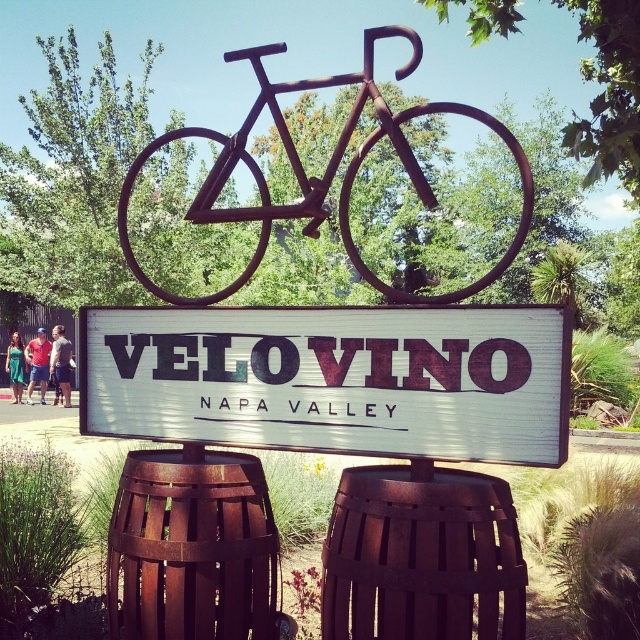
Question: Which point appears farthest from the camera in this image?

Choices:
 (A) (186, 566)
 (B) (426, 416)

Answer: (A)

Question: Is rusty metal barrel at center closer to the viewer compared to rusty wood barrel at center?

Choices:
 (A) yes
 (B) no

Answer: (A)

Question: Which object is farther from the camera taking this photo?

Choices:
 (A) white matte sign at center
 (B) rusty metal bicycle at center
 (C) rusty wood barrel at center

Answer: (C)

Question: Which object is the closest to the rusty metal bicycle at center?

Choices:
 (A) rusty wood barrel at center
 (B) white matte sign at center
 (C) rusty metal barrel at center

Answer: (A)

Question: Does rusty metal barrel at center have a larger size compared to rusty wood barrel at center?

Choices:
 (A) yes
 (B) no

Answer: (B)

Question: Does rusty metal barrel at center have a larger size compared to rusty metal bicycle at center?

Choices:
 (A) yes
 (B) no

Answer: (B)